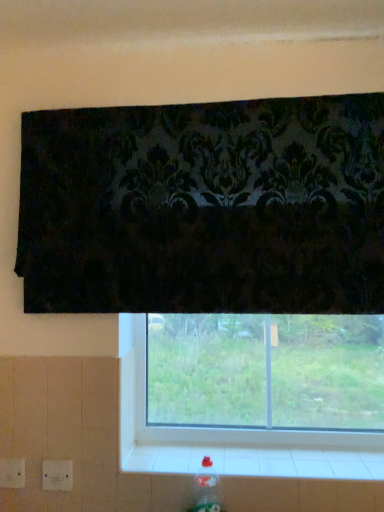
You are a GUI agent. You are given a task and a screenshot of the screen. Output one action in this format:
    pyautogui.click(x=<x>, y=<y>)
    Task: Click on the vacant space situated above white tile at lower center (from a real-world perspective)
    The width and height of the screenshot is (384, 512).
    Given the screenshot: What is the action you would take?
    pyautogui.click(x=249, y=459)